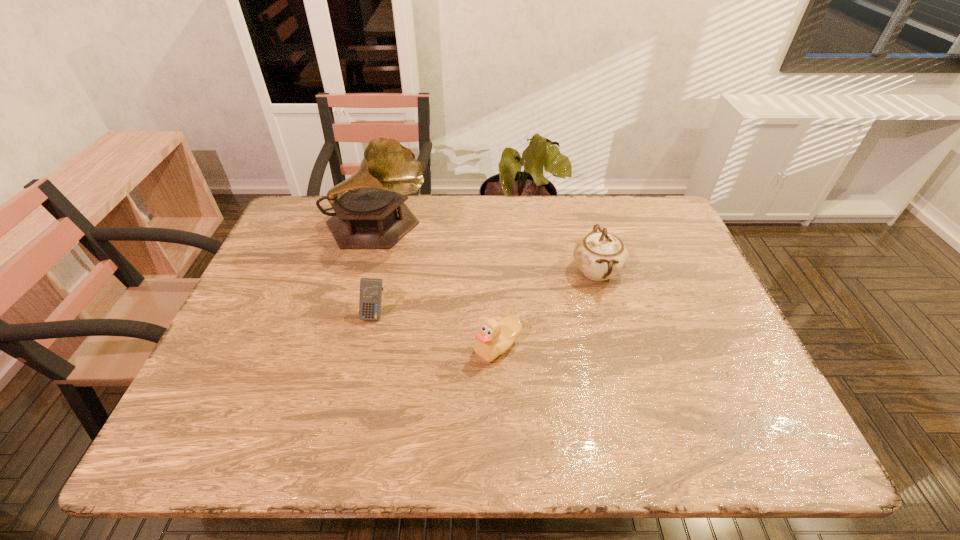
This screenshot has height=540, width=960. I want to click on free space located 0.150m at the beak of the second object from right to left, so click(409, 347).

Where is `free point located at the beak of the second object from right to left`? This screenshot has height=540, width=960. free point located at the beak of the second object from right to left is located at coordinates (348, 347).

The image size is (960, 540). In order to click on object present at the far edge in this screenshot , I will do `click(370, 213)`.

You are a GUI agent. You are given a task and a screenshot of the screen. Output one action in this format:
    pyautogui.click(x=<x>, y=<y>)
    Task: Click on the object positioned at the left edge
    The height and width of the screenshot is (540, 960).
    Given the screenshot: What is the action you would take?
    pyautogui.click(x=370, y=213)

Where is `object that is positioned at the far left corner`? The width and height of the screenshot is (960, 540). object that is positioned at the far left corner is located at coordinates (370, 213).

In the image, there is a desktop. Where is `blank space at the far edge`? The image size is (960, 540). blank space at the far edge is located at coordinates (453, 202).

This screenshot has height=540, width=960. In the image, there is a desktop. What are the coordinates of `vacant space at the near edge` in the screenshot? It's located at (429, 419).

You are a GUI agent. You are given a task and a screenshot of the screen. Output one action in this format:
    pyautogui.click(x=<x>, y=<y>)
    Task: Click on the free space at the left edge of the desktop
    The width and height of the screenshot is (960, 540).
    Given the screenshot: What is the action you would take?
    pyautogui.click(x=300, y=291)

Find the location of `vacant space at the right edge of the desktop`. vacant space at the right edge of the desktop is located at coordinates (680, 330).

Identify the location of free region at the far left corner. (323, 220).